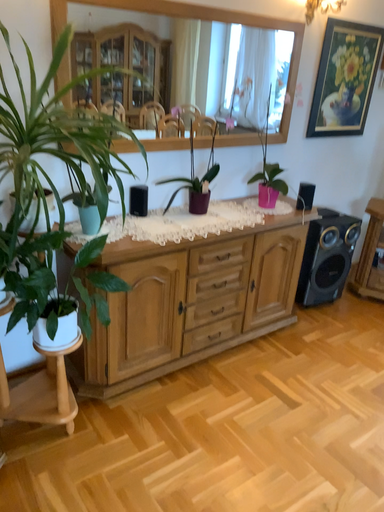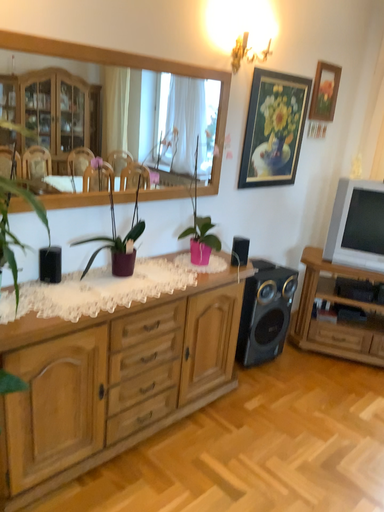
Question: How did the camera likely rotate when shooting the video?

Choices:
 (A) rotated right
 (B) rotated left

Answer: (A)